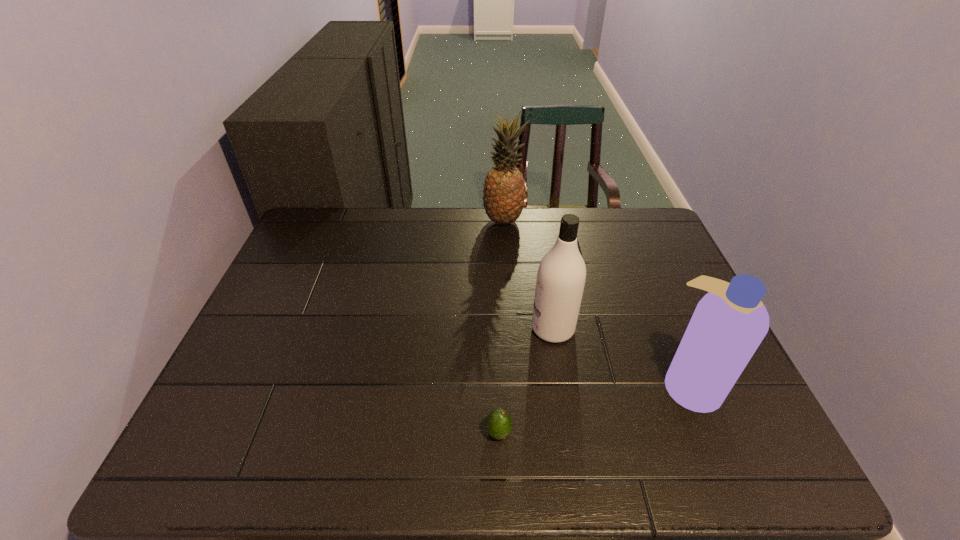
Where is `pineapple`? This screenshot has width=960, height=540. pineapple is located at coordinates (504, 190).

Image resolution: width=960 pixels, height=540 pixels. Identify the location of the second farthest object. (561, 275).

You are a GUI agent. You are given a task and a screenshot of the screen. Output one action in this format:
    pyautogui.click(x=<x>, y=<y>)
    Task: Click on the farther shampoo
    
    Given the screenshot: What is the action you would take?
    pyautogui.click(x=561, y=275)

Where is `the nearer shampoo`? the nearer shampoo is located at coordinates (729, 323).

Find the location of a particular element. the rightmost object is located at coordinates (729, 323).

You are a GUI agent. You are given a task and a screenshot of the screen. Output one action in this format:
    pyautogui.click(x=<x>, y=<y>)
    Task: Click on the avocado
    
    Given the screenshot: What is the action you would take?
    pyautogui.click(x=498, y=425)

Locate an element on the screen. the shortest object is located at coordinates (498, 425).

You are a GUI agent. You are given a task and a screenshot of the screen. Output one action in this format:
    pyautogui.click(x=<x>, y=<y>)
    Task: Click on the vacant position located on the front of the farthest object
    This screenshot has width=960, height=540.
    Given the screenshot: What is the action you would take?
    pyautogui.click(x=505, y=246)

Where is `blank space located 0.210m on the front-facing side of the left shampoo`? blank space located 0.210m on the front-facing side of the left shampoo is located at coordinates (450, 329).

Locate an element on the screen. The height and width of the screenshot is (540, 960). vacant area situated 0.220m on the front-facing side of the left shampoo is located at coordinates coord(446,329).